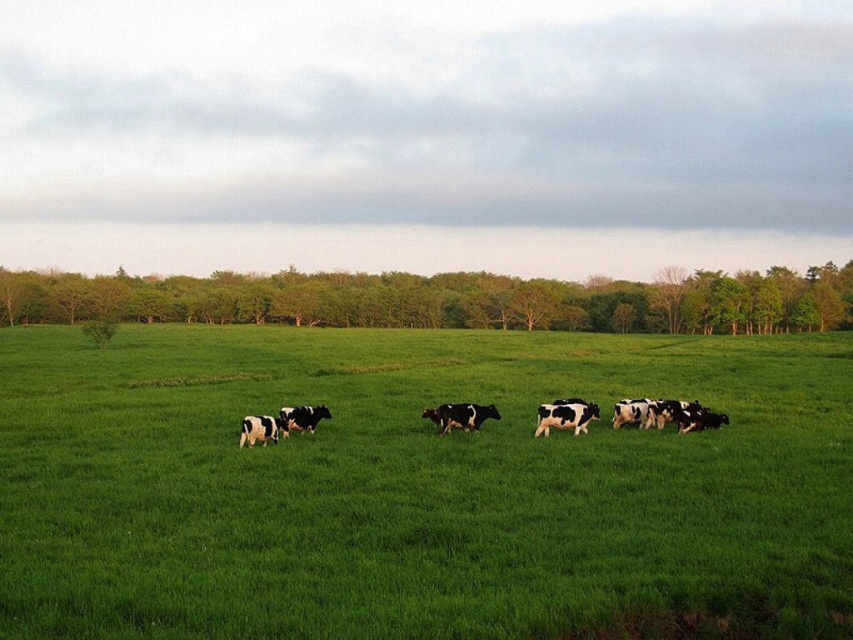
You are a farmer planning to expand your herd. You observe the green grass pasture at center and the black and white spotted cows at center in the image. Which area has more space available for additional cows?

The green grass pasture at center has a larger width than the black and white spotted cows at center, indicating there is more space available for additional cows in the pasture.

You are a farmer standing in the middle of the green grass pasture at center. You notice the green leafy trees at upper center in the distance. In which direction should you walk to reach the trees?

The green leafy trees at upper center are above the green grass pasture at center, so you should walk forward or upward in the direction of the upper part of the field to reach them.